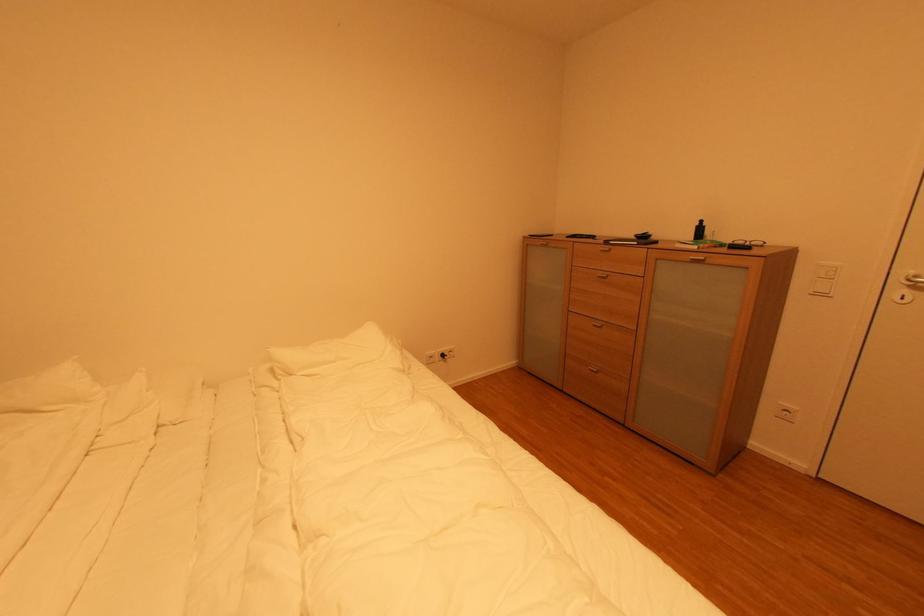
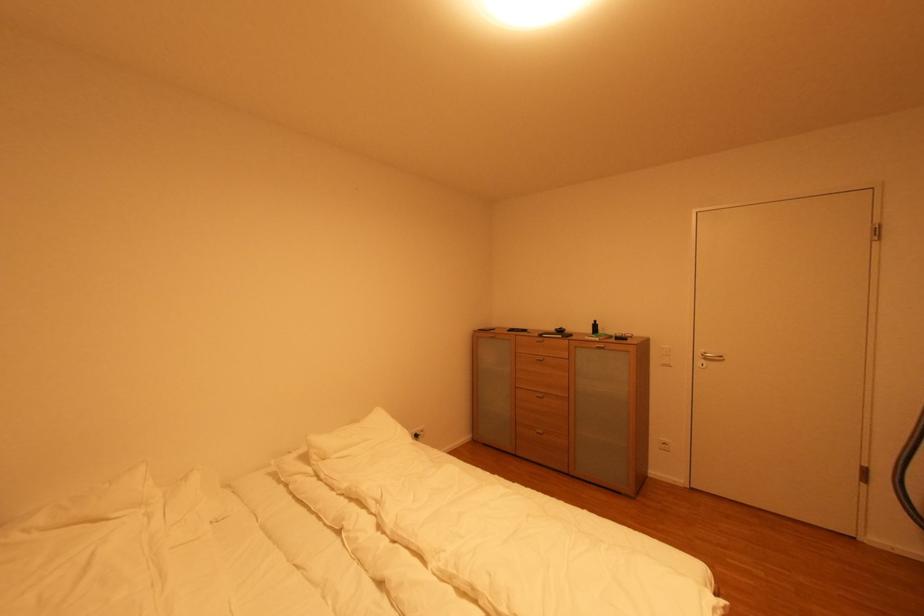
The point at (x=754, y=249) is marked in the first image. Where is the corresponding point in the second image?

(630, 339)